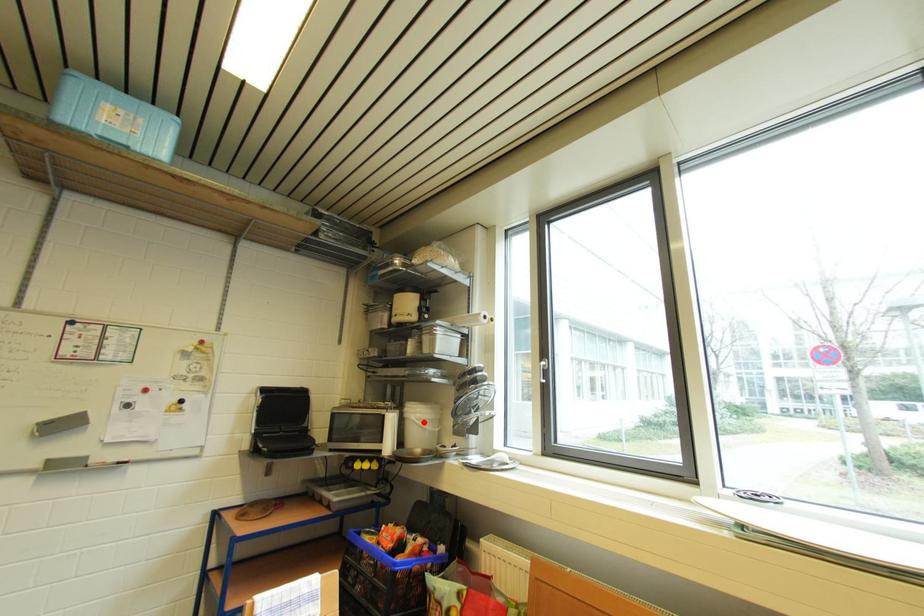
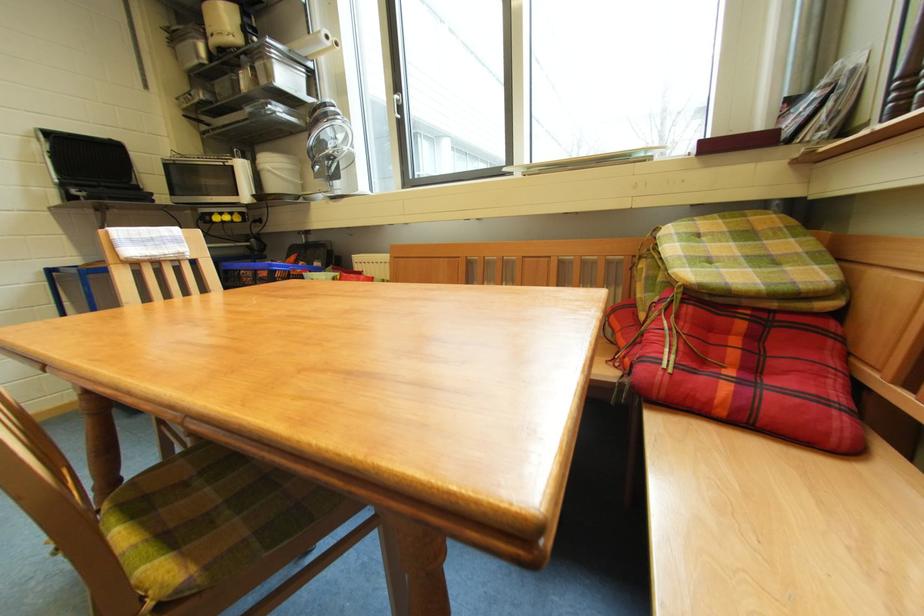
In the second image, find the point that corresponds to the highlighted location in the first image.

(281, 171)